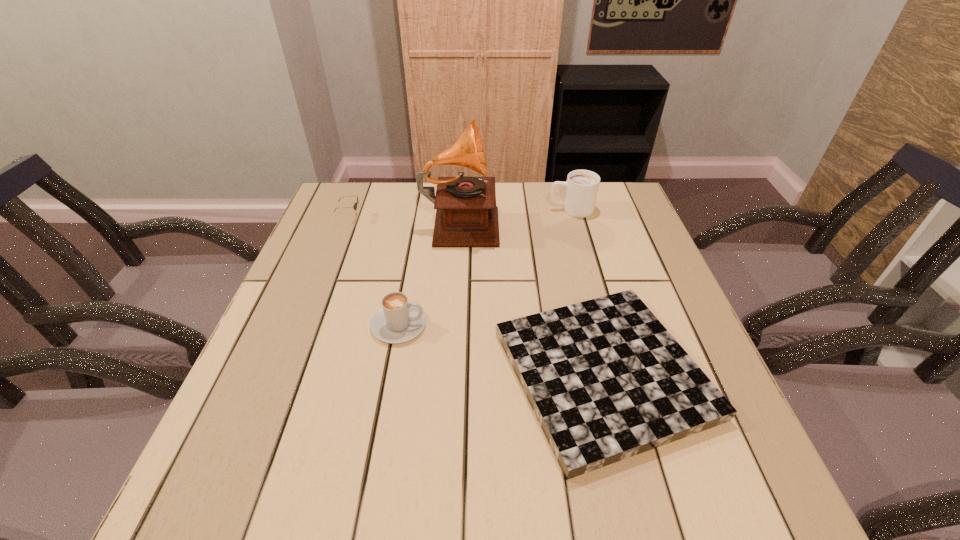
You are a GUI agent. You are given a task and a screenshot of the screen. Output one action in this format:
    pyautogui.click(x=<x>, y=<y>)
    Task: Click on the checkerboard that is positioned at the right edge
    The height and width of the screenshot is (540, 960).
    Given the screenshot: What is the action you would take?
    pyautogui.click(x=606, y=380)

Where is `object that is positioned at the far left corner`? The image size is (960, 540). object that is positioned at the far left corner is located at coordinates click(355, 205).

Locate an element on the screen. This screenshot has height=540, width=960. object that is positioned at the far right corner is located at coordinates [582, 186].

At what (x,y) coordinates should I click in order to perform the action: click on object located in the near right corner section of the desktop. Please return your answer as a coordinate pair (x, y). Looking at the image, I should click on (606, 380).

The image size is (960, 540). Identify the location of free spot at the far edge of the desktop. (423, 198).

This screenshot has height=540, width=960. In the image, there is a desktop. In order to click on free region at the left edge in this screenshot , I will do `click(301, 296)`.

In the image, there is a desktop. Identify the location of free space at the right edge. (675, 335).

Locate an element on the screen. free space at the far left corner of the desktop is located at coordinates (337, 186).

You are a GUI agent. You are given a task and a screenshot of the screen. Output one action in this format:
    pyautogui.click(x=<x>, y=<y>)
    Task: Click on the vacant area that lies between the checkerboard and the tallest object
    This screenshot has height=540, width=960.
    Given the screenshot: What is the action you would take?
    pyautogui.click(x=532, y=297)

Where is `empty space that is in between the leftmost object and the nearer cappuccino`? empty space that is in between the leftmost object and the nearer cappuccino is located at coordinates (374, 271).